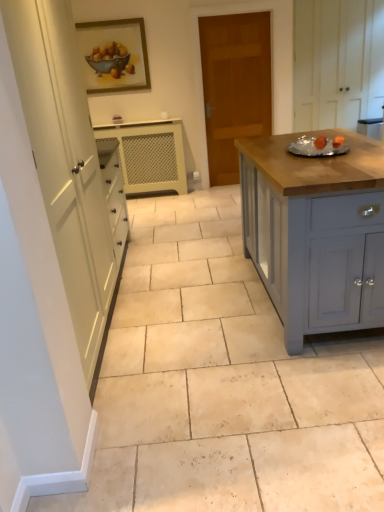
What are the coordinates of `white wood cabinet at upper right, which is the 2th cabinetry in back-to-front order` in the screenshot? It's located at (337, 62).

This screenshot has width=384, height=512. What are the coordinates of `matte gray cabinet at right, which is the first cabinetry in bottom-to-top order` in the screenshot? It's located at (316, 232).

Describe the element at coordinates (234, 86) in the screenshot. I see `wooden door at center` at that location.

Identify the location of white textured cabinet at center, which is the second cabinetry from top to bottom. [x=149, y=155].

From the picture: Considering the positions of objects wooden door at center and white textured cabinet at center, the second cabinetry from the bottom, in the image provided, who is in front, wooden door at center or white textured cabinet at center, the second cabinetry from the bottom,?

wooden door at center is more forward.

Between wooden door at center and white textured cabinet at center, which is the second cabinetry from top to bottom, which one has more height?

wooden door at center.

Between white wood cabinet at upper right, the 2th cabinetry in the front-to-back sequence, and white textured cabinet at center, the second cabinetry from the bottom, which one has more height?

Standing taller between the two is white wood cabinet at upper right, the 2th cabinetry in the front-to-back sequence.

Could you tell me if white wood cabinet at upper right, which is the 2th cabinetry in back-to-front order, is turned towards white textured cabinet at center, acting as the first cabinetry starting from the left?

No.

Does point (308, 8) appear closer or farther from the camera than point (159, 161)?

Point (308, 8).

How much distance is there between wooden door at center and white tile floor at center?

They are 3.07 meters apart.

Considering the relative sizes of wooden door at center and white tile floor at center in the image provided, is wooden door at center smaller than white tile floor at center?

Yes.

Find the location of a particular element. door lying behind the white tile floor at center is located at coordinates (234, 86).

Are wooden door at center and white tile floor at center beside each other?

wooden door at center and white tile floor at center are not in contact.

Is white tile floor at center wider than matte gray cabinet at right, which appears as the third cabinetry when viewed from the top?

Indeed, white tile floor at center has a greater width compared to matte gray cabinet at right, which appears as the third cabinetry when viewed from the top.

From the image's perspective, is white tile floor at center above matte gray cabinet at right, which appears as the third cabinetry when viewed from the top?

Incorrect, from the image's perspective, white tile floor at center is lower than matte gray cabinet at right, which appears as the third cabinetry when viewed from the top.

How many degrees apart are the facing directions of white tile floor at center and matte gray cabinet at right, which appears as the 2th cabinetry when viewed from the left?

The angle between the facing direction of white tile floor at center and the facing direction of matte gray cabinet at right, which appears as the 2th cabinetry when viewed from the left, is 0.168 degrees.

Is white tile floor at center far from matte gray cabinet at right, which is the first cabinetry in bottom-to-top order?

white tile floor at center is near matte gray cabinet at right, which is the first cabinetry in bottom-to-top order, not far away.

Choose the correct answer: Is wooden framed painting at upper center inside white textured cabinet at center, the 3th cabinetry positioned from the front, or outside it?

wooden framed painting at upper center is located beyond the bounds of white textured cabinet at center, the 3th cabinetry positioned from the front.

Is point (84, 36) less distant than point (135, 169)?

Yes, point (84, 36) is in front of point (135, 169).

Is matte gray cabinet at right, which is the first cabinetry in bottom-to-top order, facing away from white tile floor at center?

That's not correct — matte gray cabinet at right, which is the first cabinetry in bottom-to-top order, is not looking away from white tile floor at center.

Locate an element on the screen. The height and width of the screenshot is (512, 384). cabinetry that is the 1st object located above the white tile floor at center (from the image's perspective) is located at coordinates pos(316,232).

Between matte gray cabinet at right, marked as the second cabinetry in a right-to-left arrangement, and white tile floor at center, which one has larger width?

white tile floor at center.

Looking at this image, which object is closer to the camera, matte gray cabinet at right, which appears as the third cabinetry when viewed from the top, or white tile floor at center?

Positioned in front is white tile floor at center.

Is wooden framed painting at upper center in contact with white tile floor at center?

No, wooden framed painting at upper center is not next to white tile floor at center.

Based on their sizes in the image, would you say wooden framed painting at upper center is bigger or smaller than white tile floor at center?

In the image, wooden framed painting at upper center appears to be smaller than white tile floor at center.

Is wooden framed painting at upper center aimed at white tile floor at center?

No, wooden framed painting at upper center is not aimed at white tile floor at center.

Does wooden framed painting at upper center have a lesser height compared to white tile floor at center?

No, wooden framed painting at upper center is not shorter than white tile floor at center.

Locate an element on the screen. The image size is (384, 512). door on the right of white textured cabinet at center, the 3th cabinetry positioned from the front is located at coordinates (234, 86).

Locate an element on the screen. cabinetry located above the white textured cabinet at center, which is counted as the 3th cabinetry, starting from the right (from the image's perspective) is located at coordinates (337, 62).

Looking at the image, which one is located further to white wood cabinet at upper right, which is the 2th cabinetry in back-to-front order, white textured cabinet at center, the 3th cabinetry positioned from the front, or wooden framed painting at upper center?

wooden framed painting at upper center lies further to white wood cabinet at upper right, which is the 2th cabinetry in back-to-front order, than the other object.

Looking at this image, based on their spatial positions, is wooden framed painting at upper center or white tile floor at center closer to matte gray cabinet at right, which is the first cabinetry in bottom-to-top order?

The object closer to matte gray cabinet at right, which is the first cabinetry in bottom-to-top order, is white tile floor at center.

Considering their positions, is white wood cabinet at upper right, the first cabinetry in the top-to-bottom sequence, positioned closer to wooden door at center than wooden framed painting at upper center?

white wood cabinet at upper right, the first cabinetry in the top-to-bottom sequence, is closer to wooden door at center.

Considering their positions, is wooden door at center positioned closer to white wood cabinet at upper right, the 2th cabinetry in the front-to-back sequence, than white tile floor at center?

wooden door at center is closer to white wood cabinet at upper right, the 2th cabinetry in the front-to-back sequence.

Based on their spatial positions, is wooden door at center or white wood cabinet at upper right, which is the 2th cabinetry in back-to-front order, further from wooden framed painting at upper center?

white wood cabinet at upper right, which is the 2th cabinetry in back-to-front order.

Looking at the image, which one is located closer to white textured cabinet at center, which is the 1th cabinetry in back-to-front order, wooden framed painting at upper center or white wood cabinet at upper right, which is the 2th cabinetry in back-to-front order?

Based on the image, wooden framed painting at upper center appears to be nearer to white textured cabinet at center, which is the 1th cabinetry in back-to-front order.

Based on the photo, looking at the image, which one is located further to white textured cabinet at center, which is counted as the 3th cabinetry, starting from the right, white tile floor at center or white wood cabinet at upper right, which is the 2th cabinetry in back-to-front order?

white tile floor at center.

Based on their spatial positions, is white wood cabinet at upper right, the third cabinetry ordered from the bottom, or white tile floor at center further from wooden framed painting at upper center?

The object further to wooden framed painting at upper center is white tile floor at center.

Locate an element on the screen. Image resolution: width=384 pixels, height=512 pixels. door between matte gray cabinet at right, the 1th cabinetry when ordered from front to back, and white textured cabinet at center, which is the 1th cabinetry in back-to-front order, along the z-axis is located at coordinates (234, 86).

Locate an element on the screen. door between white tile floor at center and white textured cabinet at center, the second cabinetry from the bottom, from front to back is located at coordinates (234, 86).

The image size is (384, 512). I want to click on picture frame located between matte gray cabinet at right, marked as the second cabinetry in a right-to-left arrangement, and white textured cabinet at center, which is the second cabinetry from top to bottom, in the depth direction, so pos(113,55).

Locate an element on the screen. This screenshot has width=384, height=512. cabinetry between white tile floor at center and white wood cabinet at upper right, which is the 2th cabinetry in back-to-front order, from front to back is located at coordinates (316, 232).